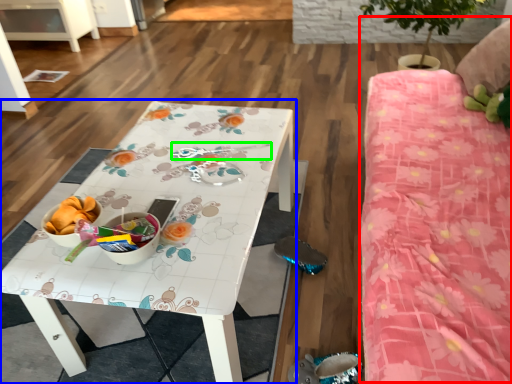
Question: Which object is the closest to the bed (highlighted by a red box)? Choose among these: table (highlighted by a blue box) or twin (highlighted by a green box).

Choices:
 (A) table
 (B) twin

Answer: (A)